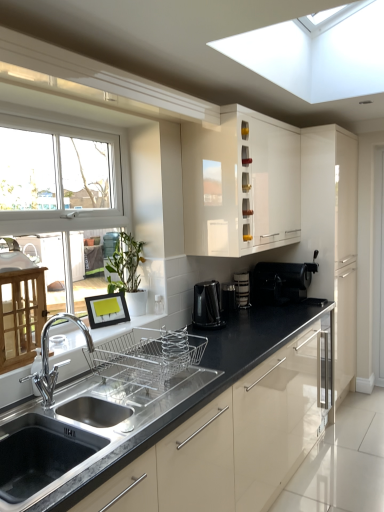
You are a GUI agent. You are given a task and a screenshot of the screen. Output one action in this format:
    pyautogui.click(x=<x>, y=<y>)
    Task: Click on the stainless steel sink at lower left
    This screenshot has height=512, width=384.
    Given the screenshot: What is the action you would take?
    pyautogui.click(x=97, y=410)

Find the location of `chrome metallic faucet at lower left`. chrome metallic faucet at lower left is located at coordinates (57, 362).

The width and height of the screenshot is (384, 512). Describe the element at coordinates (57, 362) in the screenshot. I see `chrome metallic faucet at lower left` at that location.

The height and width of the screenshot is (512, 384). Describe the element at coordinates (125, 263) in the screenshot. I see `green matte plant at center` at that location.

In order to click on matte black coffee maker at center, the first appliance in the right-to-left sequence in this screenshot , I will do `click(242, 290)`.

Between stainless steel sink at lower left and black plastic coffee machine at lower right, the 2th coffee machine when ordered from front to back, which one has smaller width?

Thinner between the two is stainless steel sink at lower left.

Is stainless steel sink at lower left placed right next to black plastic coffee machine at lower right, which is the second coffee machine from left to right?

No, stainless steel sink at lower left is not next to black plastic coffee machine at lower right, which is the second coffee machine from left to right.

Which object is further away from the camera taking this photo, stainless steel sink at lower left or black plastic coffee machine at lower right, the 2th coffee machine when ordered from front to back?

black plastic coffee machine at lower right, the 2th coffee machine when ordered from front to back, is more distant.

Visually, is stainless steel sink at lower left positioned to the left or to the right of black plastic coffee machine at lower right, which ranks as the first coffee machine in back-to-front order?

Clearly, stainless steel sink at lower left is on the left of black plastic coffee machine at lower right, which ranks as the first coffee machine in back-to-front order, in the image.

Is matte black coffee maker at center, the first appliance in the right-to-left sequence, behind glossy cream cabinet at right, the second cabinetry positioned from the left?

No, matte black coffee maker at center, the first appliance in the right-to-left sequence, is in front of glossy cream cabinet at right, the second cabinetry positioned from the left.

Is matte black coffee maker at center, marked as the 2th appliance in a left-to-right arrangement, at the right side of glossy cream cabinet at right, the second cabinetry positioned from the left?

No.

Considering the sizes of matte black coffee maker at center, marked as the 2th appliance in a left-to-right arrangement, and glossy cream cabinet at right, which appears as the first cabinetry when viewed from the right, in the image, is matte black coffee maker at center, marked as the 2th appliance in a left-to-right arrangement, taller or shorter than glossy cream cabinet at right, which appears as the first cabinetry when viewed from the right,?

Considering their sizes, matte black coffee maker at center, marked as the 2th appliance in a left-to-right arrangement, has less height than glossy cream cabinet at right, which appears as the first cabinetry when viewed from the right.

Is matte black coffee maker at center, the first appliance in the right-to-left sequence, facing towards glossy cream cabinet at right, the second cabinetry positioned from the left?

No, matte black coffee maker at center, the first appliance in the right-to-left sequence, is not turned towards glossy cream cabinet at right, the second cabinetry positioned from the left.

Which object is positioned more to the left, white glossy cabinet at upper center, placed as the second cabinetry when sorted from right to left, or matte black coffee maker at center, marked as the 2th appliance in a left-to-right arrangement?

matte black coffee maker at center, marked as the 2th appliance in a left-to-right arrangement, is more to the left.

In the scene shown: Is white glossy cabinet at upper center, placed as the second cabinetry when sorted from right to left, placed right next to matte black coffee maker at center, marked as the 2th appliance in a left-to-right arrangement?

No.

Does white glossy cabinet at upper center, the first cabinetry viewed from the left, have a greater width compared to matte black coffee maker at center, marked as the 2th appliance in a left-to-right arrangement?

Yes.

Are stainless steel sink at lower left and black plastic coffee maker at center, acting as the first appliance starting from the left, beside each other?

stainless steel sink at lower left is not next to black plastic coffee maker at center, acting as the first appliance starting from the left, and they're not touching.

Can you confirm if stainless steel sink at lower left is smaller than black plastic coffee maker at center, which ranks as the 2th appliance in right-to-left order?

Actually, stainless steel sink at lower left might be larger than black plastic coffee maker at center, which ranks as the 2th appliance in right-to-left order.

Is the depth of stainless steel sink at lower left greater than that of black plastic coffee maker at center, which ranks as the 2th appliance in right-to-left order?

No.

Does stainless steel sink at lower left appear on the right side of black plastic coffee maker at center, acting as the first appliance starting from the left?

In fact, stainless steel sink at lower left is to the left of black plastic coffee maker at center, acting as the first appliance starting from the left.

Does point (302, 285) lie behind point (209, 288)?

Yes.

Consider the image. Is black plastic coffee machine at lower right, the 1th coffee machine when ordered from right to left, far from black glossy coffee machine at center, which ranks as the 2th coffee machine in right-to-left order?

No, black plastic coffee machine at lower right, the 1th coffee machine when ordered from right to left, is in close proximity to black glossy coffee machine at center, which ranks as the 2th coffee machine in right-to-left order.

Looking at this image, how different are the orientations of black plastic coffee machine at lower right, which is the second coffee machine from left to right, and black glossy coffee machine at center, arranged as the 1th coffee machine when viewed from the left, in degrees?

The angle between the facing direction of black plastic coffee machine at lower right, which is the second coffee machine from left to right, and the facing direction of black glossy coffee machine at center, arranged as the 1th coffee machine when viewed from the left, is 5.08 degrees.

Considering the sizes of black plastic coffee machine at lower right, the 2th coffee machine when ordered from front to back, and black glossy coffee machine at center, which ranks as the 2th coffee machine in right-to-left order, in the image, is black plastic coffee machine at lower right, the 2th coffee machine when ordered from front to back, wider or thinner than black glossy coffee machine at center, which ranks as the 2th coffee machine in right-to-left order,?

Clearly, black plastic coffee machine at lower right, the 2th coffee machine when ordered from front to back, has more width compared to black glossy coffee machine at center, which ranks as the 2th coffee machine in right-to-left order.

Which is more to the right, glossy cream cabinet at right, the second cabinetry positioned from the left, or chrome metallic faucet at lower left?

glossy cream cabinet at right, the second cabinetry positioned from the left, is more to the right.

Which of these two, glossy cream cabinet at right, which appears as the first cabinetry when viewed from the right, or chrome metallic faucet at lower left, is thinner?

Thinner between the two is chrome metallic faucet at lower left.

Is point (355, 170) closer to viewer compared to point (54, 387)?

No.

How many degrees apart are the facing directions of black plastic coffee maker at center, acting as the first appliance starting from the left, and matte black coffee maker at center, marked as the 2th appliance in a left-to-right arrangement?

black plastic coffee maker at center, acting as the first appliance starting from the left, and matte black coffee maker at center, marked as the 2th appliance in a left-to-right arrangement, are facing 0.0821 degrees away from each other.

From the image's perspective, is black plastic coffee maker at center, which ranks as the 2th appliance in right-to-left order, located above or below matte black coffee maker at center, marked as the 2th appliance in a left-to-right arrangement?

Clearly, from the image's perspective, black plastic coffee maker at center, which ranks as the 2th appliance in right-to-left order, is below matte black coffee maker at center, marked as the 2th appliance in a left-to-right arrangement.

Which is in front, point (222, 310) or point (236, 279)?

The point (222, 310) is closer.

Which of these two, black plastic coffee maker at center, which ranks as the 2th appliance in right-to-left order, or matte black coffee maker at center, marked as the 2th appliance in a left-to-right arrangement, stands shorter?

black plastic coffee maker at center, which ranks as the 2th appliance in right-to-left order, is shorter.

Find the location of a particular element. Image resolution: width=384 pixels, height=512 pixels. sink below the black plastic coffee machine at lower right, the 1th coffee machine when ordered from right to left (from the image's perspective) is located at coordinates (97, 410).

Where is `the 2nd cabinetry counting from the right side of the matte black coffee maker at center, marked as the 2th appliance in a left-to-right arrangement`? This screenshot has height=512, width=384. the 2nd cabinetry counting from the right side of the matte black coffee maker at center, marked as the 2th appliance in a left-to-right arrangement is located at coordinates (332, 234).

Based on the photo, when comparing their distances from green matte plant at center, does stainless steel sink at lower left or chrome metallic faucet at lower left seem closer?

chrome metallic faucet at lower left is positioned closer to the anchor green matte plant at center.

Estimate the real-world distances between objects in this image. Which object is further from green matte plant at center, matte black coffee maker at center, the first appliance in the right-to-left sequence, or black plastic coffee machine at lower right, which is the second coffee machine from left to right?

black plastic coffee machine at lower right, which is the second coffee machine from left to right, is further to green matte plant at center.

Based on their spatial positions, is green matte plant at center or glossy cream cabinet at right, the second cabinetry positioned from the left, closer to chrome metallic faucet at lower left?

The object closer to chrome metallic faucet at lower left is green matte plant at center.

Based on their spatial positions, is black plastic coffee machine at lower right, the 2th coffee machine when ordered from front to back, or stainless steel sink at lower left closer to black plastic coffee maker at center, acting as the first appliance starting from the left?

Based on the image, black plastic coffee machine at lower right, the 2th coffee machine when ordered from front to back, appears to be nearer to black plastic coffee maker at center, acting as the first appliance starting from the left.

Which object lies nearer to the anchor point white glossy cabinet at upper center, placed as the second cabinetry when sorted from right to left, glossy cream cabinet at right, which appears as the first cabinetry when viewed from the right, or stainless steel sink at lower left?

Among the two, glossy cream cabinet at right, which appears as the first cabinetry when viewed from the right, is located nearer to white glossy cabinet at upper center, placed as the second cabinetry when sorted from right to left.

Estimate the real-world distances between objects in this image. Which object is further from black plastic coffee machine at lower right, which is the second coffee machine from left to right, stainless steel sink at lower left or white glossy cabinet at upper center, the first cabinetry viewed from the left?

stainless steel sink at lower left.

Based on their spatial positions, is green matte plant at center or stainless steel sink at lower left closer to glossy cream cabinet at right, the second cabinetry positioned from the left?

Among the two, green matte plant at center is located nearer to glossy cream cabinet at right, the second cabinetry positioned from the left.

Considering their positions, is black glossy coffee machine at center, arranged as the 1th coffee machine when viewed from the left, positioned further to white glossy cabinet at upper center, the first cabinetry viewed from the left, than glossy cream cabinet at right, the second cabinetry positioned from the left?

Among the two, glossy cream cabinet at right, the second cabinetry positioned from the left, is located further to white glossy cabinet at upper center, the first cabinetry viewed from the left.

At what (x,y) coordinates should I click in order to perform the action: click on coffee machine situated between matte black coffee maker at center, the first appliance in the right-to-left sequence, and glossy cream cabinet at right, which appears as the first cabinetry when viewed from the right, from left to right. Please return your answer as a coordinate pair (x, y). The width and height of the screenshot is (384, 512). Looking at the image, I should click on (281, 282).

Where is `tap positioned between stainless steel sink at lower left and glossy cream cabinet at right, which appears as the first cabinetry when viewed from the right, from near to far`? The image size is (384, 512). tap positioned between stainless steel sink at lower left and glossy cream cabinet at right, which appears as the first cabinetry when viewed from the right, from near to far is located at coordinates (57, 362).

You are a GUI agent. You are given a task and a screenshot of the screen. Output one action in this format:
    pyautogui.click(x=<x>, y=<y>)
    Task: Click on the plant located between stainless steel sink at lower left and matte black coffee maker at center, marked as the 2th appliance in a left-to-right arrangement, in the depth direction
    The height and width of the screenshot is (512, 384).
    Given the screenshot: What is the action you would take?
    pyautogui.click(x=125, y=263)

You are a GUI agent. You are given a task and a screenshot of the screen. Output one action in this format:
    pyautogui.click(x=<x>, y=<y>)
    Task: Click on the cabinetry between stainless steel sink at lower left and black plastic coffee machine at lower right, the 2th coffee machine when ordered from front to back, along the z-axis
    
    Given the screenshot: What is the action you would take?
    pyautogui.click(x=240, y=185)